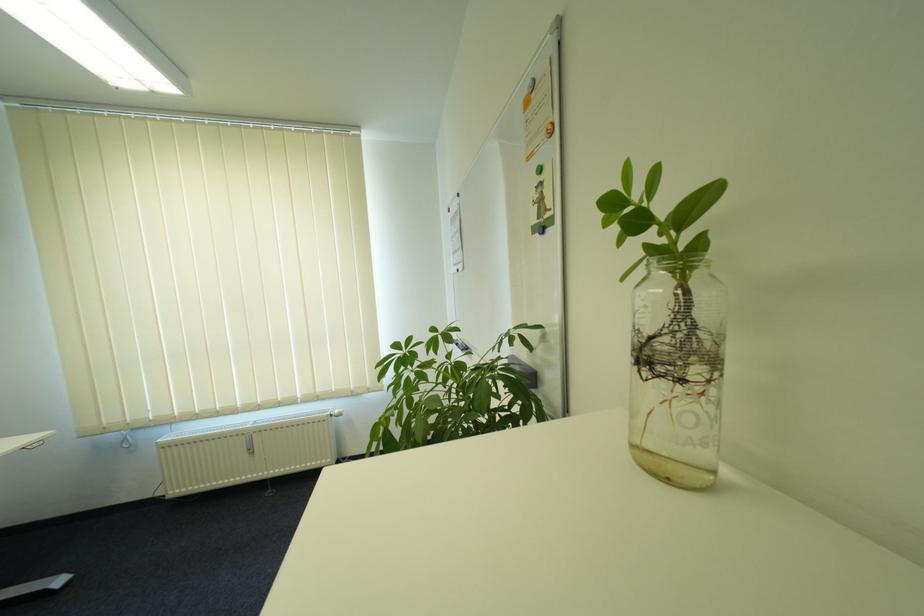
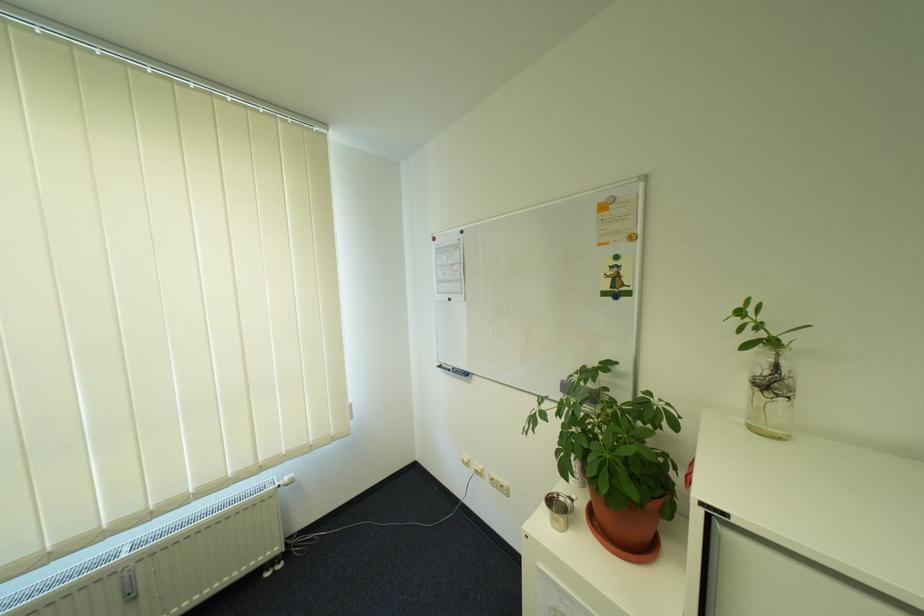
The point at (x=342, y=414) is marked in the first image. Where is the corresponding point in the second image?

(290, 484)